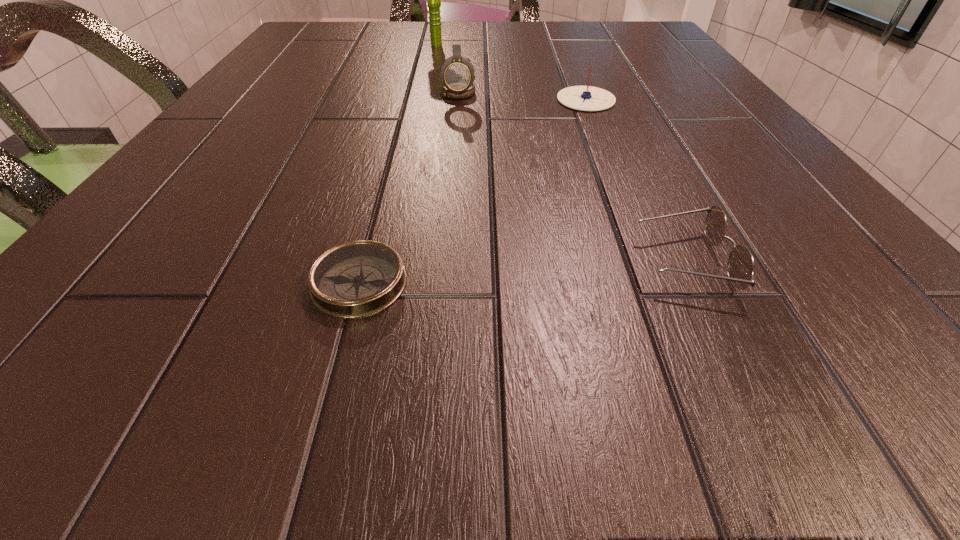
This screenshot has height=540, width=960. What are the coordinates of `free space between the microphone and the fourth tallest object` in the screenshot? It's located at (561, 153).

At what (x,y) coordinates should I click in order to perform the action: click on empty space between the fourth tallest object and the second tallest compass. Please return your answer as a coordinate pair (x, y). This screenshot has height=540, width=960. Looking at the image, I should click on (635, 180).

Find the location of a particular element. free space that is in between the tallest object and the shortest object is located at coordinates (398, 164).

Find the location of a particular element. This screenshot has width=960, height=540. free space between the shortest compass and the microphone is located at coordinates (398, 164).

Locate an element on the screen. The width and height of the screenshot is (960, 540). vacant area that lies between the leftmost compass and the fourth tallest object is located at coordinates (521, 272).

Locate which object is the second closest to the second compass from left to right. Please provide its 2D coordinates. Your answer should be formatted as a tuple, i.e. [(x, y)], where the tuple contains the x and y coordinates of a point satisfying the conditions above.

[(433, 0)]

Identify the location of object that is the third closest to the fourth shortest object. (357, 279).

Choose which compass is the second nearest neighbor to the third object from left to right. Please provide its 2D coordinates. Your answer should be formatted as a tuple, i.e. [(x, y)], where the tuple contains the x and y coordinates of a point satisfying the conditions above.

[(357, 279)]

Identify which compass is the closest to the second compass from right to left. Please provide its 2D coordinates. Your answer should be formatted as a tuple, i.e. [(x, y)], where the tuple contains the x and y coordinates of a point satisfying the conditions above.

[(586, 98)]